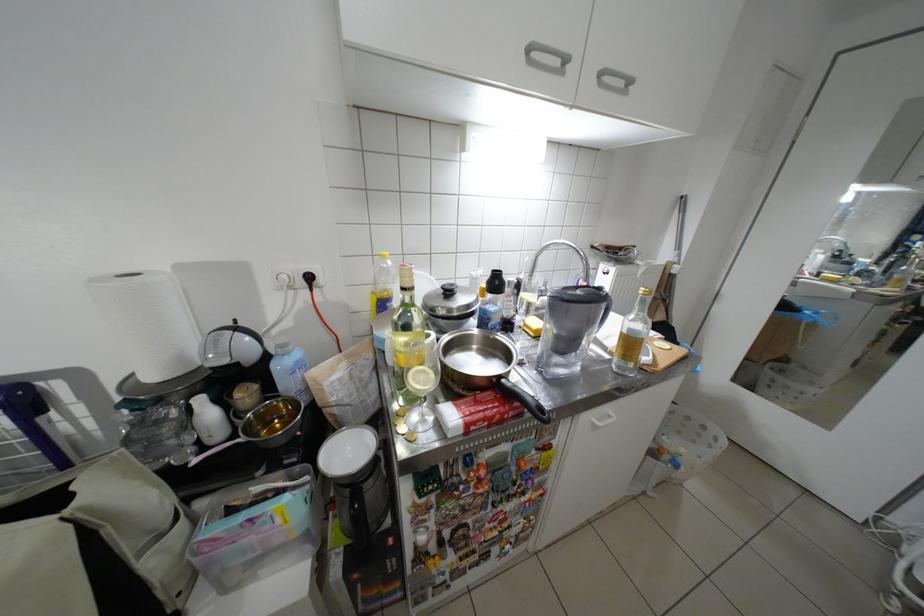
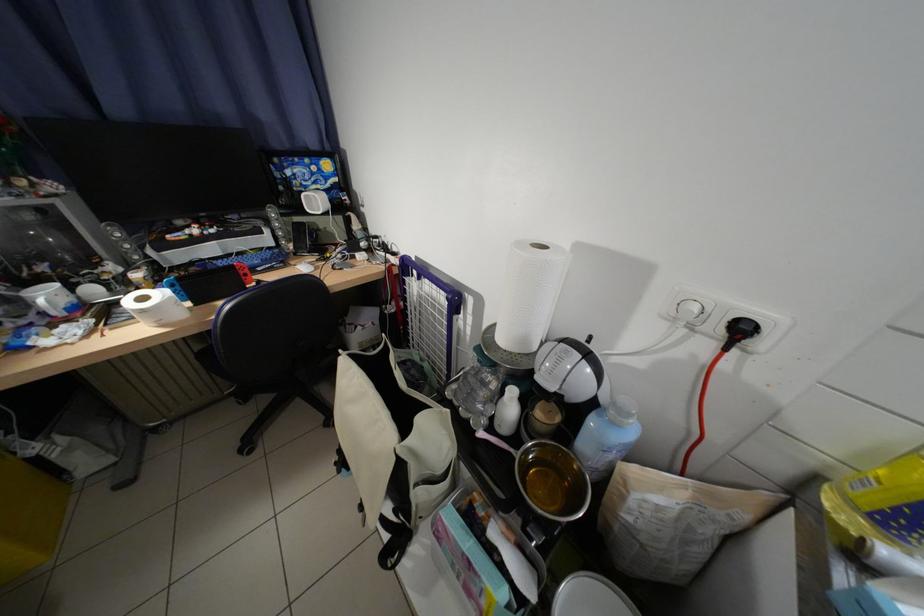
The point at (164,378) is marked in the first image. Where is the corresponding point in the second image?

(514, 341)